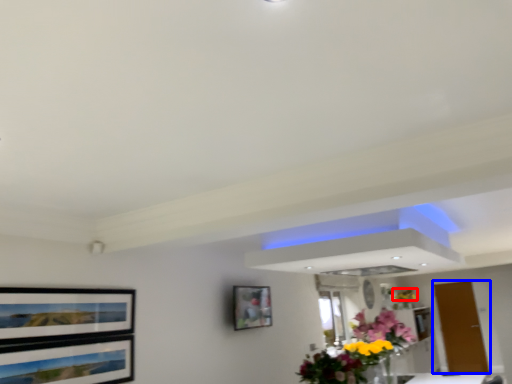
Question: Which object is further to the camera taking this photo, flower (highlighted by a red box) or door (highlighted by a blue box)?

Choices:
 (A) flower
 (B) door

Answer: (A)